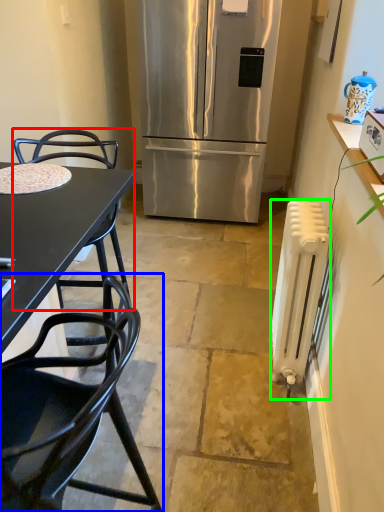
Question: Which object is the farthest from chair (highlighted by a red box)? Choose among these: chair (highlighted by a blue box) or radiator (highlighted by a green box).

Choices:
 (A) chair
 (B) radiator

Answer: (A)